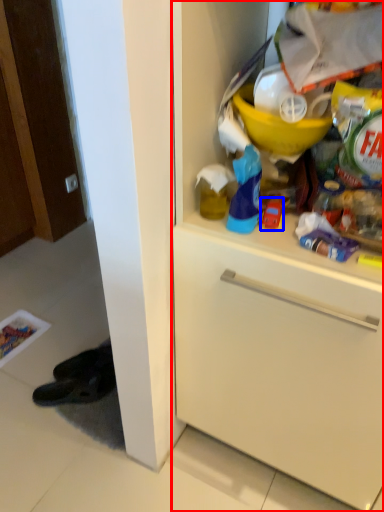
Question: Which point is further to the camera, cabinetry (highlighted by a red box) or toy (highlighted by a blue box)?

Choices:
 (A) cabinetry
 (B) toy

Answer: (B)